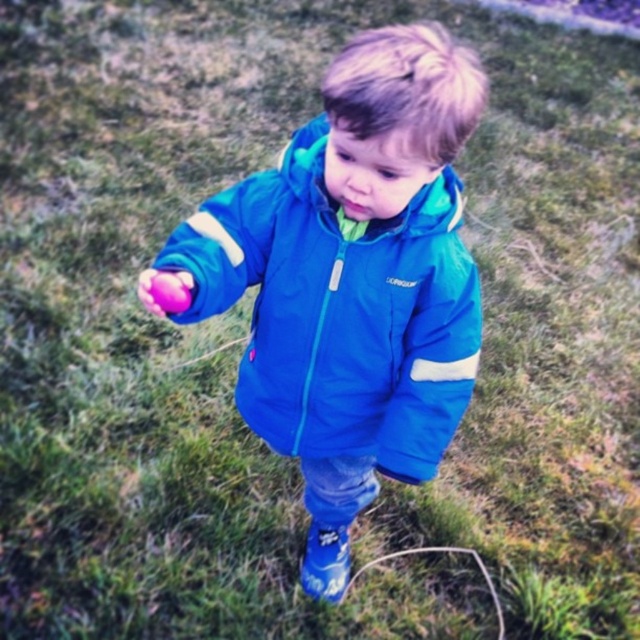
Question: Observing the image, what is the correct spatial positioning of blue fabric jacket at center in reference to shiny purple ball at center?

Choices:
 (A) below
 (B) above

Answer: (A)

Question: Does blue fabric jacket at center have a greater width compared to shiny purple ball at center?

Choices:
 (A) no
 (B) yes

Answer: (B)

Question: Is blue fabric jacket at center smaller than shiny purple ball at center?

Choices:
 (A) no
 (B) yes

Answer: (A)